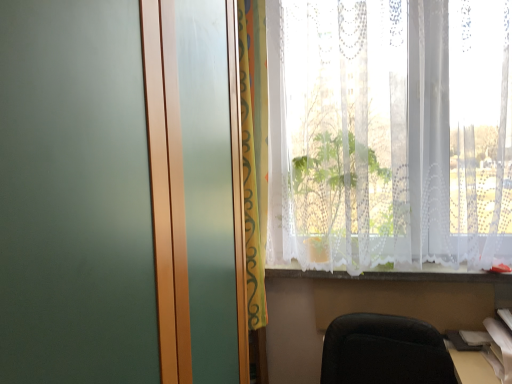
This screenshot has height=384, width=512. What are the coordinates of `multicolored fabric curtain at center` in the screenshot? It's located at (254, 151).

This screenshot has height=384, width=512. I want to click on white paper at lower right, so click(x=499, y=350).

Describe the element at coordinates (384, 351) in the screenshot. Image resolution: width=512 pixels, height=384 pixels. I see `black leather chair at lower right` at that location.

Where is `multicolored fabric curtain at center`? Image resolution: width=512 pixels, height=384 pixels. multicolored fabric curtain at center is located at coordinates (254, 151).

Would you say black leather chair at lower right is a long distance from white paper at lower right?

That's not correct — black leather chair at lower right is a little close to white paper at lower right.

Measure the distance between black leather chair at lower right and white paper at lower right.

black leather chair at lower right and white paper at lower right are 12.93 inches apart from each other.

Is black leather chair at lower right surrounding white paper at lower right?

No, white paper at lower right is located outside of black leather chair at lower right.

Considering the sizes of objects black leather chair at lower right and white paper at lower right in the image provided, who is wider, black leather chair at lower right or white paper at lower right?

With larger width is black leather chair at lower right.

Considering their positions, is white paper at lower right located in front of or behind white lace curtain at lower center?

In the image, white paper at lower right appears in front of white lace curtain at lower center.

Does white paper at lower right turn towards white lace curtain at lower center?

No, white paper at lower right does not turn towards white lace curtain at lower center.

Locate an element on the screen. The width and height of the screenshot is (512, 384). book located underneath the white lace curtain at lower center (from a real-world perspective) is located at coordinates (499, 350).

Is white paper at lower right smaller than white lace curtain at upper right?

Yes, white paper at lower right is smaller than white lace curtain at upper right.

From a real-world perspective, is white paper at lower right below white lace curtain at upper right?

Yes, from a real-world perspective, white paper at lower right is below white lace curtain at upper right.

Does multicolored fabric curtain at center appear on the left side of white paper at lower right?

Yes, multicolored fabric curtain at center is to the left of white paper at lower right.

Is multicolored fabric curtain at center positioned far away from white paper at lower right?

multicolored fabric curtain at center is positioned a significant distance from white paper at lower right.

Consider the image. Is multicolored fabric curtain at center oriented away from white paper at lower right?

multicolored fabric curtain at center is not turned away from white paper at lower right.

Between white paper at lower right and black leather chair at lower right, which one has smaller size?

white paper at lower right.

Looking at their sizes, would you say white paper at lower right is wider or thinner than black leather chair at lower right?

white paper at lower right is thinner than black leather chair at lower right.

From the picture: Is white paper at lower right at the left side of black leather chair at lower right?

Incorrect, white paper at lower right is not on the left side of black leather chair at lower right.

Relative to black leather chair at lower right, is white paper at lower right in front or behind?

Visually, white paper at lower right is located behind black leather chair at lower right.

Considering the relative sizes of white lace curtain at upper right and white lace curtain at lower center in the image provided, is white lace curtain at upper right smaller than white lace curtain at lower center?

No.

Between white lace curtain at upper right and white lace curtain at lower center, which one is positioned in front?

Positioned in front is white lace curtain at upper right.

Would you say white lace curtain at lower center is outside white lace curtain at upper right?

Yes, white lace curtain at lower center is outside of white lace curtain at upper right.

From a real-world perspective, who is located lower, white lace curtain at lower center or white lace curtain at upper right?

white lace curtain at lower center, from a real-world perspective.

Is white lace curtain at lower center far from white lace curtain at upper right?

No, there isn't a large distance between white lace curtain at lower center and white lace curtain at upper right.

Looking at this image, is white lace curtain at lower center facing away from white lace curtain at upper right?

No, white lace curtain at lower center is not facing away from white lace curtain at upper right.

I want to click on book above the black leather chair at lower right (from a real-world perspective), so click(499, 350).

The height and width of the screenshot is (384, 512). In order to click on window sill above the white paper at lower right (from the image's perspective) in this screenshot , I will do `click(393, 274)`.

Estimate the real-world distances between objects in this image. Which object is closer to white lace curtain at upper right, white paper at lower right or white lace curtain at lower center?

white lace curtain at lower center lies closer to white lace curtain at upper right than the other object.

Considering their positions, is white lace curtain at upper right positioned closer to white paper at lower right than white lace curtain at lower center?

white lace curtain at lower center is positioned closer to the anchor white paper at lower right.

Estimate the real-world distances between objects in this image. Which object is further from white lace curtain at lower center, black leather chair at lower right or multicolored fabric curtain at center?

multicolored fabric curtain at center is further to white lace curtain at lower center.

Which object lies further to the anchor point black leather chair at lower right, white lace curtain at upper right or multicolored fabric curtain at center?

multicolored fabric curtain at center is further to black leather chair at lower right.

Considering their positions, is multicolored fabric curtain at center positioned closer to white lace curtain at lower center than black leather chair at lower right?

The object closer to white lace curtain at lower center is black leather chair at lower right.

Which object lies nearer to the anchor point multicolored fabric curtain at center, white lace curtain at upper right or black leather chair at lower right?

Among the two, white lace curtain at upper right is located nearer to multicolored fabric curtain at center.

Consider the image. Which object lies nearer to the anchor point white paper at lower right, white lace curtain at lower center or white lace curtain at upper right?

white lace curtain at lower center is closer to white paper at lower right.

When comparing their distances from white lace curtain at lower center, does white paper at lower right or multicolored fabric curtain at center seem closer?

white paper at lower right lies closer to white lace curtain at lower center than the other object.

The height and width of the screenshot is (384, 512). Find the location of `window sill that lies between white lace curtain at upper right and white paper at lower right from top to bottom`. window sill that lies between white lace curtain at upper right and white paper at lower right from top to bottom is located at coordinates (393, 274).

At what (x,y) coordinates should I click in order to perform the action: click on chair between multicolored fabric curtain at center and white paper at lower right in the horizontal direction. Please return your answer as a coordinate pair (x, y). This screenshot has width=512, height=384. Looking at the image, I should click on (384, 351).

Locate an element on the screen. The height and width of the screenshot is (384, 512). window sill between multicolored fabric curtain at center and white paper at lower right in the horizontal direction is located at coordinates (393, 274).

This screenshot has width=512, height=384. I want to click on book between black leather chair at lower right and white lace curtain at lower center along the z-axis, so click(x=499, y=350).